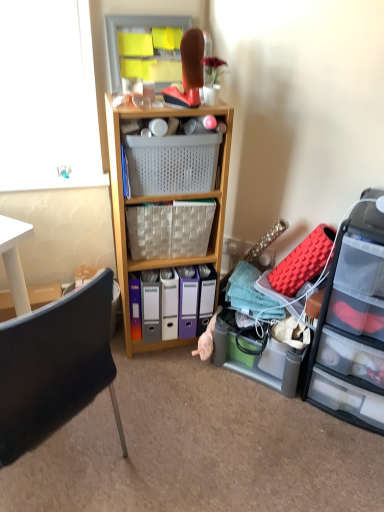
Question: Can you confirm if clear plastic drawers at right is thinner than black plastic chair at lower left?

Choices:
 (A) yes
 (B) no

Answer: (A)

Question: Can you confirm if clear plastic drawers at right is taller than black plastic chair at lower left?

Choices:
 (A) no
 (B) yes

Answer: (A)

Question: From a real-world perspective, is clear plastic drawers at right beneath black plastic chair at lower left?

Choices:
 (A) yes
 (B) no

Answer: (A)

Question: Does clear plastic drawers at right touch black plastic chair at lower left?

Choices:
 (A) no
 (B) yes

Answer: (A)

Question: Is clear plastic drawers at right at the right side of black plastic chair at lower left?

Choices:
 (A) no
 (B) yes

Answer: (B)

Question: Can we say clear plastic drawers at right lies outside black plastic chair at lower left?

Choices:
 (A) no
 (B) yes

Answer: (B)

Question: Can you confirm if plastic mesh basket at center, placed as the first picnic basket when sorted from top to bottom, is positioned to the left of black plastic chair at lower left?

Choices:
 (A) yes
 (B) no

Answer: (B)

Question: From the image's perspective, is plastic mesh basket at center, placed as the first picnic basket when sorted from top to bottom, beneath black plastic chair at lower left?

Choices:
 (A) yes
 (B) no

Answer: (B)

Question: Considering the relative sizes of plastic mesh basket at center, placed as the first picnic basket when sorted from top to bottom, and black plastic chair at lower left in the image provided, is plastic mesh basket at center, placed as the first picnic basket when sorted from top to bottom, bigger than black plastic chair at lower left?

Choices:
 (A) yes
 (B) no

Answer: (B)

Question: Considering the relative positions of plastic mesh basket at center, placed as the first picnic basket when sorted from top to bottom, and black plastic chair at lower left in the image provided, is plastic mesh basket at center, placed as the first picnic basket when sorted from top to bottom, in front of black plastic chair at lower left?

Choices:
 (A) yes
 (B) no

Answer: (B)

Question: From the image's perspective, is plastic mesh basket at center, placed as the first picnic basket when sorted from top to bottom, on black plastic chair at lower left?

Choices:
 (A) yes
 (B) no

Answer: (A)

Question: Is plastic mesh basket at center, placed as the first picnic basket when sorted from top to bottom, positioned far away from black plastic chair at lower left?

Choices:
 (A) yes
 (B) no

Answer: (B)

Question: Does clear plastic drawers at right have a greater height compared to wooden shelf at center?

Choices:
 (A) no
 (B) yes

Answer: (A)